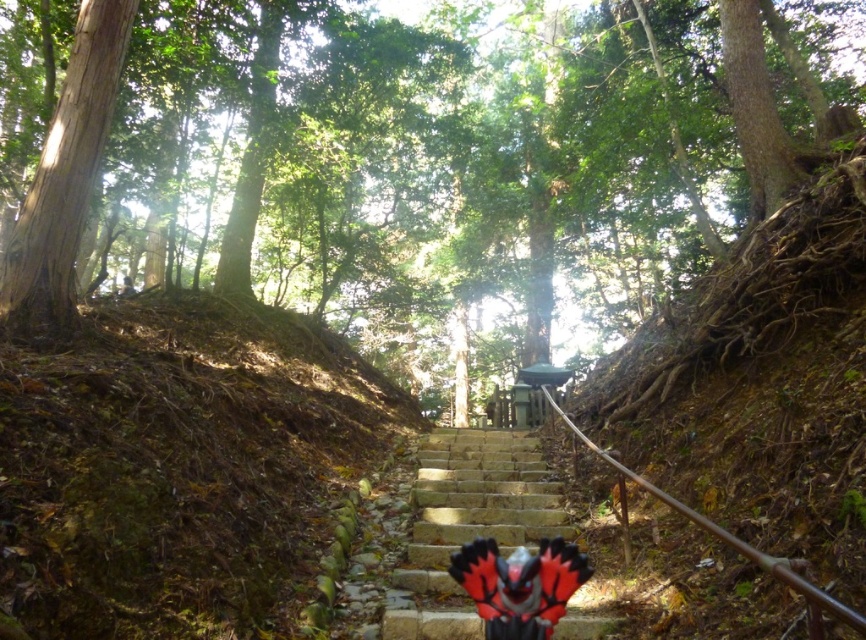
Can you confirm if brown rough tree at center is taller than brown/dry soil at left?

Yes, brown rough tree at center is taller than brown/dry soil at left.

Can you confirm if brown rough tree at center is positioned above brown/dry soil at left?

Yes.

What do you see at coordinates (462, 148) in the screenshot? The height and width of the screenshot is (640, 866). I see `brown rough tree at center` at bounding box center [462, 148].

Locate an element on the screen. The height and width of the screenshot is (640, 866). brown rough tree at center is located at coordinates click(462, 148).

Who is taller, brown rough tree at center or stone stairs at center?

Standing taller between the two is brown rough tree at center.

Is brown rough tree at center wider than stone stairs at center?

Yes, brown rough tree at center is wider than stone stairs at center.

At what (x,y) coordinates should I click in order to perform the action: click on brown rough tree at center. Please return your answer as a coordinate pair (x, y). Looking at the image, I should click on (462, 148).

Find the location of `brown rough tree at center`. brown rough tree at center is located at coordinates (462, 148).

Which of these two, brown/dry soil at left or stone stairs at center, stands taller?

brown/dry soil at left is taller.

Locate an element on the screen. brown/dry soil at left is located at coordinates (178, 465).